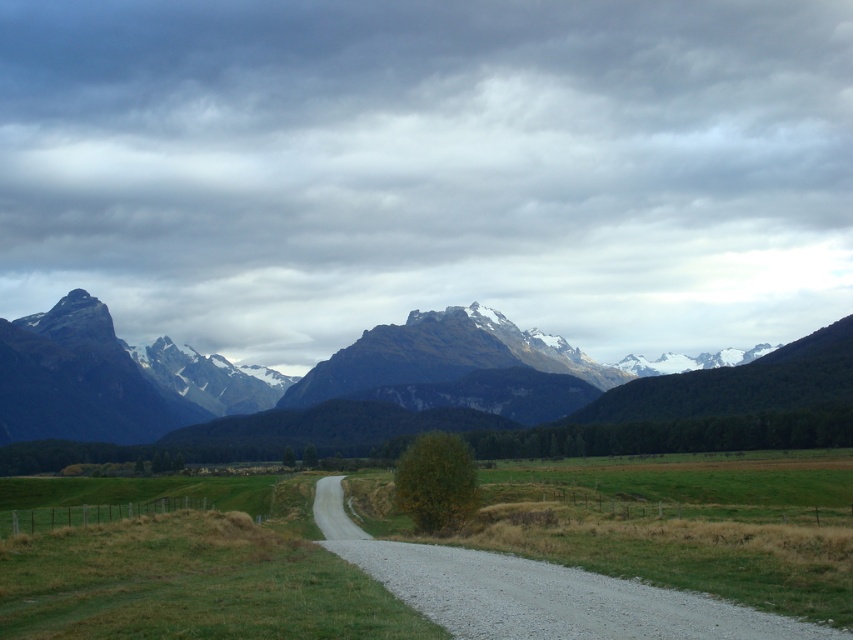
Between point (80, 371) and point (341, 531), which one is positioned behind?

Point (80, 371)

Is snowy rocky mountain range at center smaller than gravel road at center?

Actually, snowy rocky mountain range at center might be larger than gravel road at center.

Is point (351, 376) positioned behind point (322, 492)?

Yes.

Identify the location of snowy rocky mountain range at center. The height and width of the screenshot is (640, 853). (381, 388).

Who is taller, snowy granite mountain at center or gravel road at center?

With more height is snowy granite mountain at center.

Identify the location of snowy granite mountain at center. The image size is (853, 640). (457, 369).

Between snowy rocky mountain range at center and gray gravel road at center, which one is positioned higher?

snowy rocky mountain range at center is higher up.

Is snowy rocky mountain range at center to the right of gray gravel road at center from the viewer's perspective?

No, snowy rocky mountain range at center is not to the right of gray gravel road at center.

I want to click on snowy rocky mountain range at center, so click(x=381, y=388).

What are the coordinates of `snowy rocky mountain range at center` in the screenshot? It's located at (381, 388).